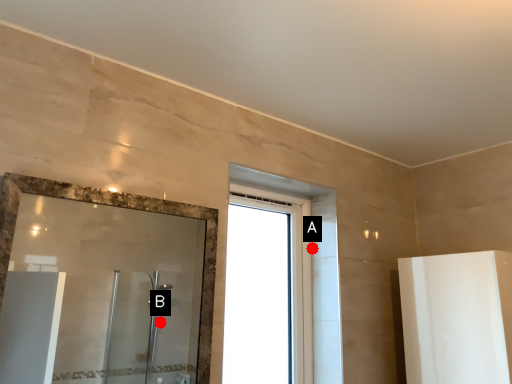
Question: Two points are circled on the image, labeled by A and B beside each circle. Which point is closer to the camera?

Choices:
 (A) A is closer
 (B) B is closer

Answer: (A)